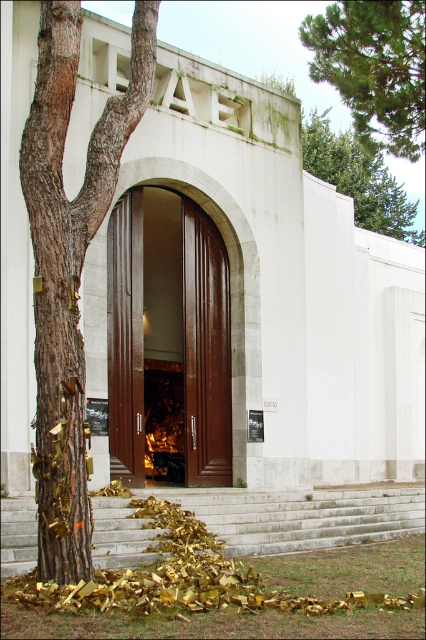
Question: Estimate the real-world distances between objects in this image. Which object is closer to the smooth brown bark at left?

Choices:
 (A) white stone stairs at center
 (B) green pine tree at upper right
 (C) green mossy wall at upper center
 (D) brown wooden door at center

Answer: (A)

Question: Considering the relative positions of brown wooden door at center and green pine tree at upper right in the image provided, where is brown wooden door at center located with respect to green pine tree at upper right?

Choices:
 (A) below
 (B) above

Answer: (A)

Question: Does brown wooden door at center have a smaller size compared to brown polished wood door at center?

Choices:
 (A) no
 (B) yes

Answer: (A)

Question: Which object appears closest to the camera in this image?

Choices:
 (A) brown wooden door at center
 (B) green mossy wall at upper center

Answer: (A)

Question: Is brown wooden door at center above green pine tree at upper right?

Choices:
 (A) no
 (B) yes

Answer: (A)

Question: Estimate the real-world distances between objects in this image. Which object is farther from the brown wooden door at center?

Choices:
 (A) smooth brown bark at left
 (B) green mossy wall at upper center

Answer: (B)